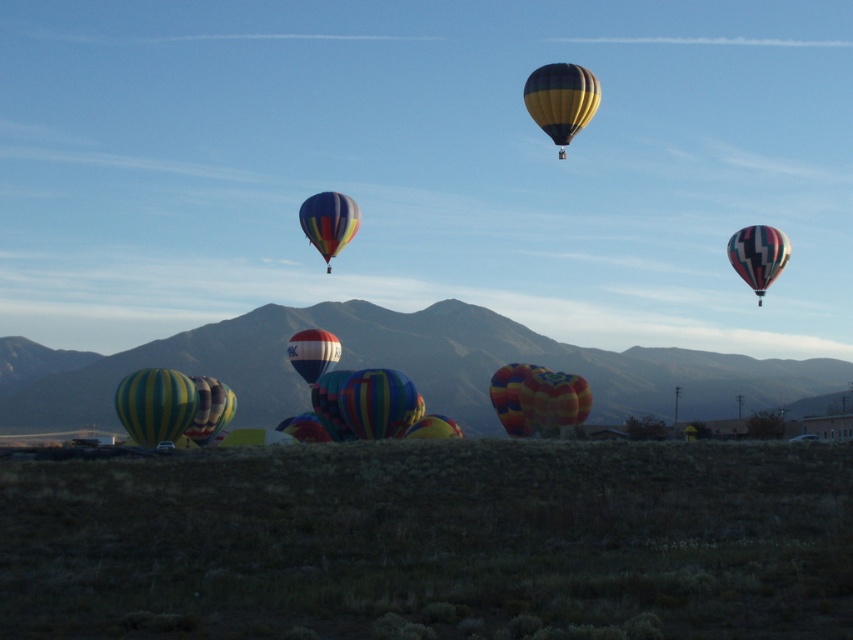
Question: Among these points, which one is nearest to the camera?

Choices:
 (A) (368, 436)
 (B) (515, 413)
 (C) (660, 385)

Answer: (A)

Question: Can you confirm if yellow striped hot air balloon at upper center is bigger than red and white striped balloon at center?

Choices:
 (A) yes
 (B) no

Answer: (A)

Question: Is rugged brown mountain at center above red and white striped balloon at center?

Choices:
 (A) yes
 (B) no

Answer: (B)

Question: Can you confirm if shiny metallic balloon at upper right is positioned to the right of red and white striped balloon at center?

Choices:
 (A) no
 (B) yes

Answer: (B)

Question: Among these points, which one is farthest from the camera?

Choices:
 (A) (567, 90)
 (B) (741, 384)

Answer: (B)

Question: Which object is positioned farthest from the multicolored fabric balloon at center?

Choices:
 (A) multicolored fabric balloon at upper center
 (B) red and white striped balloon at center
 (C) yellow-green striped balloon at lower left

Answer: (C)